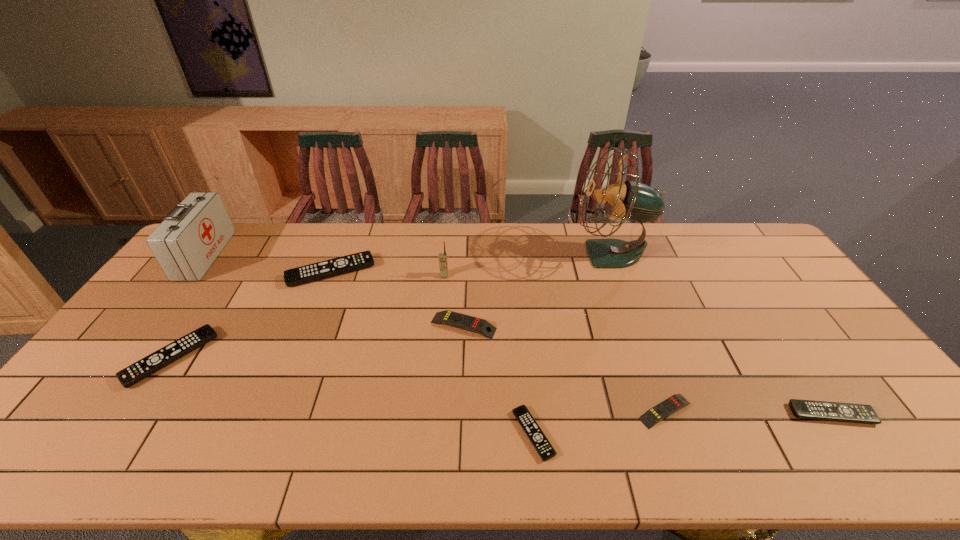
Locate an element on the screen. The width and height of the screenshot is (960, 540). the eighth closest object relative to the third tallest object is located at coordinates (806, 409).

Where is `remote control that stands as the second closest to the third smallest black remote control`? This screenshot has width=960, height=540. remote control that stands as the second closest to the third smallest black remote control is located at coordinates (450, 318).

Identify which remote control is the second nearest to the red first-aid kit. Please provide its 2D coordinates. Your answer should be formatted as a tuple, i.e. [(x, y)], where the tuple contains the x and y coordinates of a point satisfying the conditions above.

[(356, 261)]

Choose which black remote control is the third nearest neighbor to the tallest object. Please provide its 2D coordinates. Your answer should be formatted as a tuple, i.e. [(x, y)], where the tuple contains the x and y coordinates of a point satisfying the conditions above.

[(356, 261)]

Locate which black remote control is the third closest to the farthest black remote control. Please provide its 2D coordinates. Your answer should be formatted as a tuple, i.e. [(x, y)], where the tuple contains the x and y coordinates of a point satisfying the conditions above.

[(806, 409)]

Locate an element on the screen. free space that satisfies the following two spatial constraints: 1. on the front-facing side of the eighth shortest object; 2. on the right side of the second farthest black remote control is located at coordinates (128, 357).

Where is `vacant point that satisfies the following two spatial constraints: 1. on the front-facing side of the first-aid kit; 2. on the left side of the third black remote control from left to right`? This screenshot has height=540, width=960. vacant point that satisfies the following two spatial constraints: 1. on the front-facing side of the first-aid kit; 2. on the left side of the third black remote control from left to right is located at coordinates (70, 434).